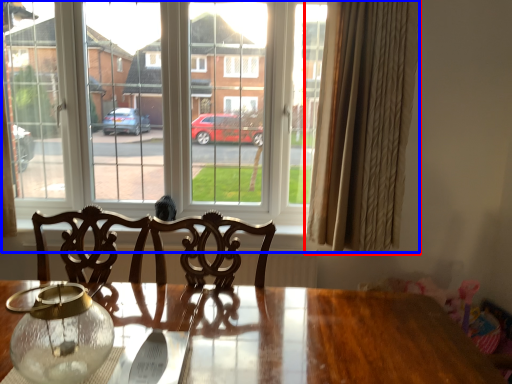
Question: Which object appears closest to the camera in this image, curtain (highlighted by a red box) or window (highlighted by a blue box)?

Choices:
 (A) curtain
 (B) window

Answer: (A)